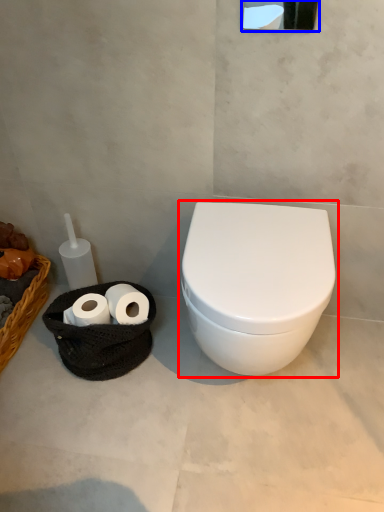
Question: Which object appears closest to the camera in this image, toilet (highlighted by a red box) or mirror (highlighted by a blue box)?

Choices:
 (A) toilet
 (B) mirror

Answer: (B)